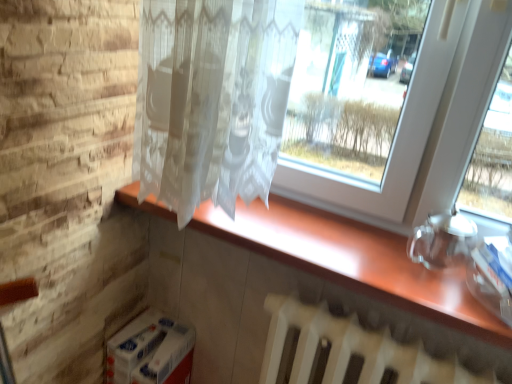
Question: Visually, is wooden counter at center positioned to the left or to the right of white matte radiator at lower center?

Choices:
 (A) right
 (B) left

Answer: (B)

Question: Is point (397, 271) closer or farther from the camera than point (309, 362)?

Choices:
 (A) closer
 (B) farther

Answer: (A)

Question: In terms of height, does wooden counter at center look taller or shorter compared to white matte radiator at lower center?

Choices:
 (A) tall
 (B) short

Answer: (B)

Question: From their relative heights in the image, would you say white matte radiator at lower center is taller or shorter than wooden counter at center?

Choices:
 (A) tall
 (B) short

Answer: (A)

Question: In terms of size, does white matte radiator at lower center appear bigger or smaller than wooden counter at center?

Choices:
 (A) big
 (B) small

Answer: (A)

Question: Is point click(310, 354) positioned closer to the camera than point click(477, 307)?

Choices:
 (A) farther
 (B) closer

Answer: (A)

Question: From the image's perspective, relative to wooden counter at center, is white matte radiator at lower center above or below?

Choices:
 (A) below
 (B) above

Answer: (A)